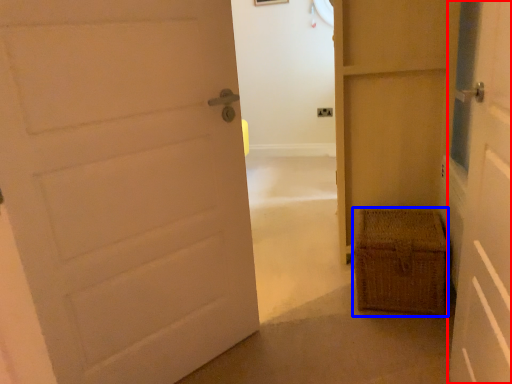
Question: Which of the following is the farthest to the observer, door (highlighted by a red box) or crate (highlighted by a blue box)?

Choices:
 (A) door
 (B) crate

Answer: (B)